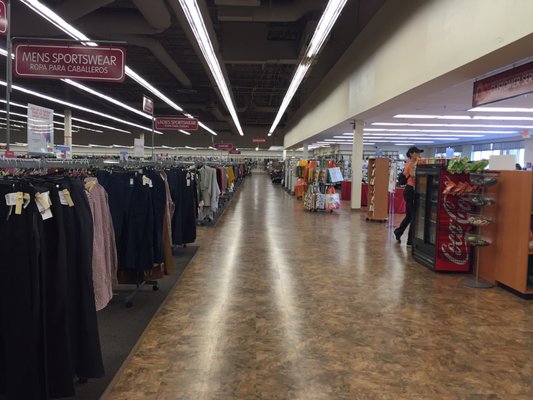
The image size is (533, 400). What are the coordinates of `tile floor` in the screenshot? It's located at (295, 298).